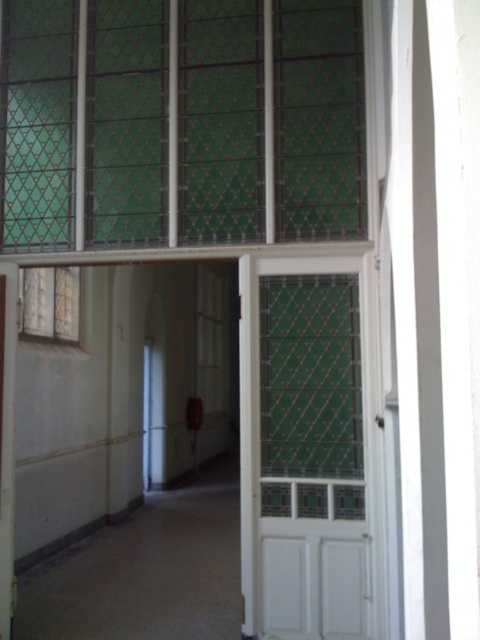
You are standing in the hallway and want to reach the door at the end. There are two points marked on the floor. One is at point [7,157] and the other at point [328,516]. Which point is closer to the door?

Point [7,157] is behind point [328,516], so the point closer to the door is point [328,516].